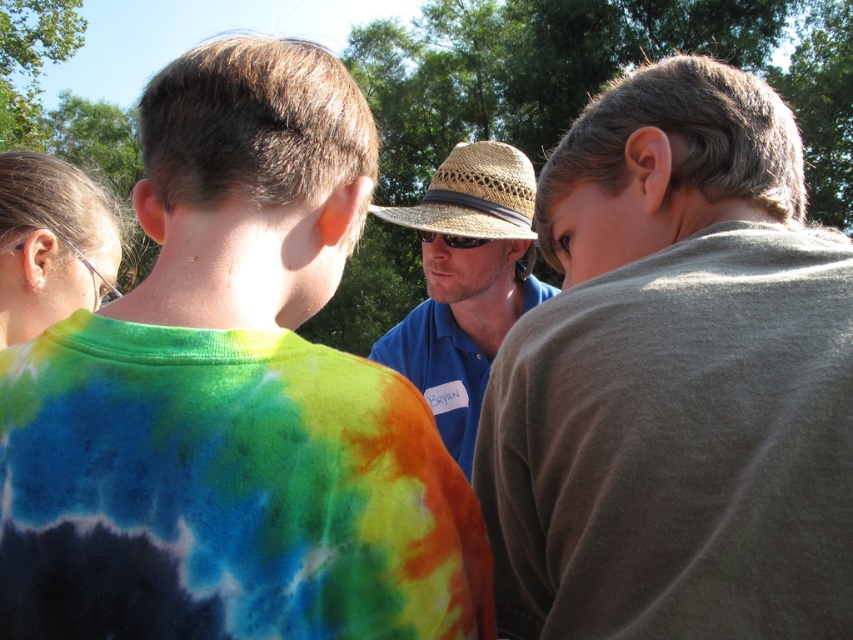
You are a photographer trying to capture a group photo of the blue shirt at center and the straw hat at center. You want to ensure both subjects are fully visible in the frame. Which subject should you position closer to the edge of the frame to avoid cropping?

The blue shirt at center has a lesser width compared to the straw hat at center, so positioning the blue shirt at center closer to the edge of the frame would allow both subjects to fit without cropping.